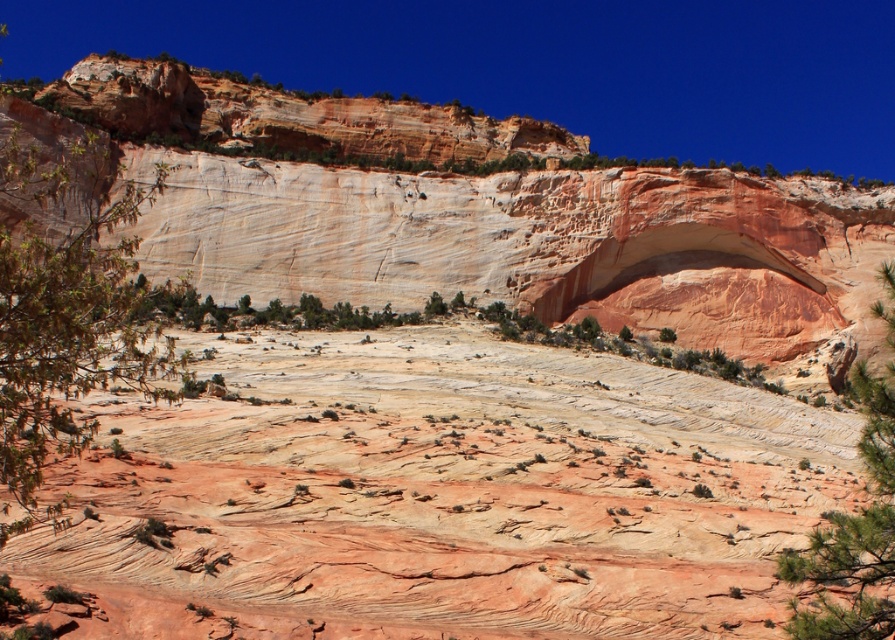
Question: Can you confirm if green leafy tree at left is wider than green leafy tree at lower right?

Choices:
 (A) yes
 (B) no

Answer: (B)

Question: Considering the real-world distances, which object is farthest from the rustic sandstone terrain at center?

Choices:
 (A) green leafy tree at lower right
 (B) green leafy tree at left

Answer: (B)

Question: Can you confirm if green leafy tree at left is smaller than green leafy tree at lower right?

Choices:
 (A) yes
 (B) no

Answer: (B)

Question: Can you confirm if rustic sandstone terrain at center is bigger than green leafy tree at lower right?

Choices:
 (A) yes
 (B) no

Answer: (B)

Question: Estimate the real-world distances between objects in this image. Which object is closer to the green leafy tree at lower right?

Choices:
 (A) rustic sandstone terrain at center
 (B) green leafy tree at left

Answer: (A)

Question: Which object is the farthest from the rustic sandstone terrain at center?

Choices:
 (A) green leafy tree at lower right
 (B) green leafy tree at left

Answer: (B)